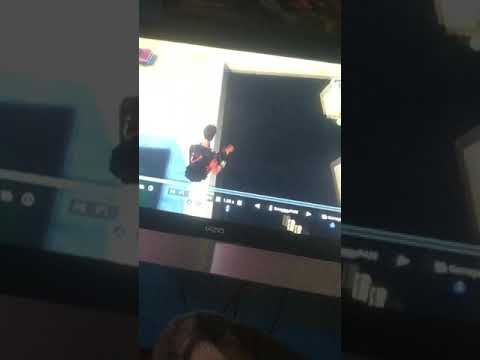
At what (x,y) coordinates should I click in order to perform the action: click on edge of a computer monitor. Please return your answer as a coordinate pair (x, y). This screenshot has height=360, width=480. Looking at the image, I should click on (217, 237).